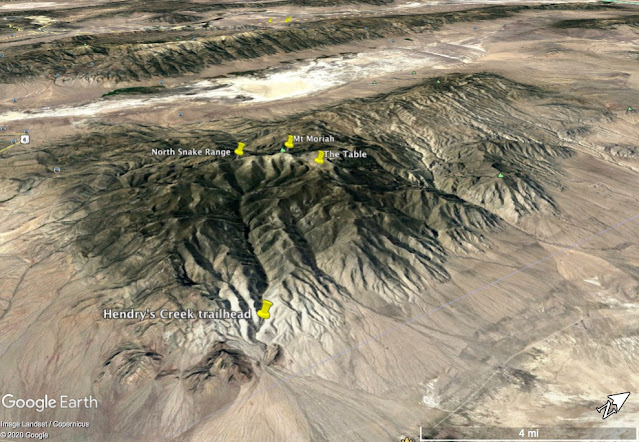
Image resolution: width=639 pixels, height=442 pixels. I want to click on table, so click(x=353, y=152).